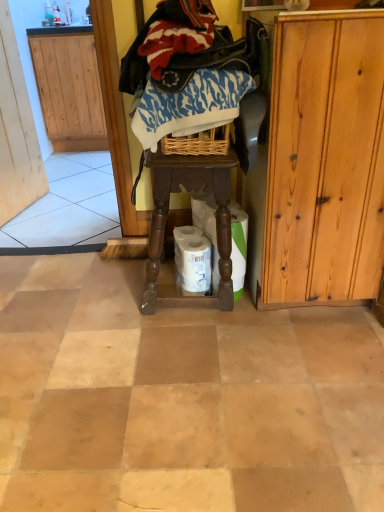
Looking at this image, measure the distance between point (350, 153) and camera.

Point (350, 153) is 3.73 feet from camera.

The width and height of the screenshot is (384, 512). I want to click on white matte toilet paper at center, which is the second toilet paper from left to right, so click(207, 228).

The width and height of the screenshot is (384, 512). Describe the element at coordinates (207, 228) in the screenshot. I see `white matte toilet paper at center, which is the second toilet paper from left to right` at that location.

Image resolution: width=384 pixels, height=512 pixels. What are the coordinates of `brown wooden stool at center` in the screenshot? It's located at (167, 218).

In order to face blue printed fabric at center, the first clothing when ordered from bottom to top, should I rotate leftwards or rightwards?

Turn right by 0.180 degrees to look at blue printed fabric at center, the first clothing when ordered from bottom to top.

What do you see at coordinates (192, 260) in the screenshot?
I see `white matte toilet paper at center, which is counted as the 1th toilet paper, starting from the left` at bounding box center [192, 260].

Identify the location of light brown wood cabinet at right. Image resolution: width=384 pixels, height=512 pixels. tap(325, 159).

What's the angular difference between knitted wool sweater at upper center, acting as the 2th clothing starting from the bottom, and blue printed fabric at center, the first clothing when ordered from bottom to top,'s facing directions?

The angle between the facing direction of knitted wool sweater at upper center, acting as the 2th clothing starting from the bottom, and the facing direction of blue printed fabric at center, the first clothing when ordered from bottom to top, is 0.00235 degrees.

Is knitted wool sweater at upper center, acting as the 2th clothing starting from the bottom, at the right side of blue printed fabric at center, which is the 2th clothing in top-to-bottom order?

No, knitted wool sweater at upper center, acting as the 2th clothing starting from the bottom, is not to the right of blue printed fabric at center, which is the 2th clothing in top-to-bottom order.

Consider the image. Can you confirm if knitted wool sweater at upper center, acting as the 2th clothing starting from the bottom, is thinner than blue printed fabric at center, which is the 2th clothing in top-to-bottom order?

Incorrect, the width of knitted wool sweater at upper center, acting as the 2th clothing starting from the bottom, is not less than that of blue printed fabric at center, which is the 2th clothing in top-to-bottom order.

Does knitted wool sweater at upper center, acting as the 2th clothing starting from the bottom, touch blue printed fabric at center, the first clothing when ordered from bottom to top?

Yes.

Between brown wooden stool at center and light brown wood cabinet at right, which one has more height?

With more height is light brown wood cabinet at right.

Which is more to the right, brown wooden stool at center or light brown wood cabinet at right?

Positioned to the right is light brown wood cabinet at right.

Is point (224, 207) farther from viewer compared to point (280, 219)?

Yes, it is.

Visually, is knitted wool sweater at upper center, acting as the 2th clothing starting from the bottom, positioned to the left or to the right of white matte toilet paper at center, which ranks as the second toilet paper in right-to-left order?

From the image, it's evident that knitted wool sweater at upper center, acting as the 2th clothing starting from the bottom, is to the left of white matte toilet paper at center, which ranks as the second toilet paper in right-to-left order.

Consider the image. From the image's perspective, relative to white matte toilet paper at center, which is counted as the 1th toilet paper, starting from the left, is knitted wool sweater at upper center, placed as the first clothing when sorted from top to bottom, above or below?

Based on their image positions, knitted wool sweater at upper center, placed as the first clothing when sorted from top to bottom, is located above white matte toilet paper at center, which is counted as the 1th toilet paper, starting from the left.

Considering the sizes of objects knitted wool sweater at upper center, acting as the 2th clothing starting from the bottom, and white matte toilet paper at center, which ranks as the second toilet paper in right-to-left order, in the image provided, who is taller, knitted wool sweater at upper center, acting as the 2th clothing starting from the bottom, or white matte toilet paper at center, which ranks as the second toilet paper in right-to-left order,?

knitted wool sweater at upper center, acting as the 2th clothing starting from the bottom.

From a real-world perspective, who is located higher, knitted wool sweater at upper center, placed as the first clothing when sorted from top to bottom, or white matte toilet paper at center, which ranks as the second toilet paper in right-to-left order?

knitted wool sweater at upper center, placed as the first clothing when sorted from top to bottom, from a real-world perspective.

From the image's perspective, relative to blue printed fabric at center, which is the 2th clothing in top-to-bottom order, is white matte toilet paper at center, which ranks as the second toilet paper in right-to-left order, above or below?

Based on their image positions, white matte toilet paper at center, which ranks as the second toilet paper in right-to-left order, is located beneath blue printed fabric at center, which is the 2th clothing in top-to-bottom order.

Is white matte toilet paper at center, which is counted as the 1th toilet paper, starting from the left, directly adjacent to blue printed fabric at center, the first clothing when ordered from bottom to top?

They are not placed beside each other.

Considering the relative positions of white matte toilet paper at center, which ranks as the second toilet paper in right-to-left order, and blue printed fabric at center, the first clothing when ordered from bottom to top, in the image provided, is white matte toilet paper at center, which ranks as the second toilet paper in right-to-left order, in front of blue printed fabric at center, the first clothing when ordered from bottom to top,?

No, white matte toilet paper at center, which ranks as the second toilet paper in right-to-left order, is behind blue printed fabric at center, the first clothing when ordered from bottom to top.

Is white matte toilet paper at center, which is counted as the 1th toilet paper, starting from the left, turned away from blue printed fabric at center, which is the 2th clothing in top-to-bottom order?

No, blue printed fabric at center, which is the 2th clothing in top-to-bottom order, is not at the back of white matte toilet paper at center, which is counted as the 1th toilet paper, starting from the left.

Is wooden screen door at left aimed at white matte toilet paper at center, which is counted as the 1th toilet paper, starting from the left?

No.

From the image's perspective, would you say wooden screen door at left is shown under white matte toilet paper at center, which ranks as the second toilet paper in right-to-left order?

Actually, wooden screen door at left appears above white matte toilet paper at center, which ranks as the second toilet paper in right-to-left order, in the image.

Which is farther from the camera, (x=186, y=250) or (x=318, y=182)?

The point (x=186, y=250) is more distant.

From the image's perspective, between white matte toilet paper at center, which ranks as the second toilet paper in right-to-left order, and light brown wood cabinet at right, which one is located above?

light brown wood cabinet at right is shown above in the image.

How different are the orientations of white matte toilet paper at center, which is counted as the 1th toilet paper, starting from the left, and light brown wood cabinet at right in degrees?

They differ by 67.1 degrees in their facing directions.

From a real-world perspective, between white matte toilet paper at center, which ranks as the second toilet paper in right-to-left order, and light brown wood cabinet at right, who is vertically higher?

light brown wood cabinet at right.

Locate an element on the screen. This screenshot has width=384, height=512. cabinetry behind the knitted wool sweater at upper center, acting as the 2th clothing starting from the bottom is located at coordinates (325, 159).

Which of these two, knitted wool sweater at upper center, acting as the 2th clothing starting from the bottom, or light brown wood cabinet at right, stands taller?

With more height is light brown wood cabinet at right.

From the image's perspective, between knitted wool sweater at upper center, placed as the first clothing when sorted from top to bottom, and light brown wood cabinet at right, who is located below?

light brown wood cabinet at right appears lower in the image.

From a real-world perspective, between knitted wool sweater at upper center, acting as the 2th clothing starting from the bottom, and light brown wood cabinet at right, who is vertically lower?

From a 3D spatial view, light brown wood cabinet at right is below.

Where is `clothing on the right of knitted wool sweater at upper center, acting as the 2th clothing starting from the bottom`? This screenshot has width=384, height=512. clothing on the right of knitted wool sweater at upper center, acting as the 2th clothing starting from the bottom is located at coordinates (189, 106).

Image resolution: width=384 pixels, height=512 pixels. I want to click on furniture that is on the left side of light brown wood cabinet at right, so pyautogui.click(x=167, y=218).

Which object lies further to the anchor point blue printed fabric at center, which is the 2th clothing in top-to-bottom order, wooden screen door at left or white matte toilet paper at center, which ranks as the second toilet paper in right-to-left order?

wooden screen door at left is positioned further to the anchor blue printed fabric at center, which is the 2th clothing in top-to-bottom order.

Consider the image. Considering their positions, is white matte toilet paper at center, which is the second toilet paper from left to right, positioned closer to white matte toilet paper at center, which ranks as the second toilet paper in right-to-left order, than knitted wool sweater at upper center, acting as the 2th clothing starting from the bottom?

Based on the image, white matte toilet paper at center, which is the second toilet paper from left to right, appears to be nearer to white matte toilet paper at center, which ranks as the second toilet paper in right-to-left order.

Looking at the image, which one is located closer to white matte toilet paper at center, acting as the 1th toilet paper starting from the right, white matte toilet paper at center, which is counted as the 1th toilet paper, starting from the left, or brown wooden stool at center?

white matte toilet paper at center, which is counted as the 1th toilet paper, starting from the left, is positioned closer to the anchor white matte toilet paper at center, acting as the 1th toilet paper starting from the right.

Considering their positions, is blue printed fabric at center, the first clothing when ordered from bottom to top, positioned closer to knitted wool sweater at upper center, acting as the 2th clothing starting from the bottom, than light brown wood cabinet at right?

blue printed fabric at center, the first clothing when ordered from bottom to top, lies closer to knitted wool sweater at upper center, acting as the 2th clothing starting from the bottom, than the other object.

Based on their spatial positions, is blue printed fabric at center, which is the 2th clothing in top-to-bottom order, or white matte toilet paper at center, acting as the 1th toilet paper starting from the right, closer to knitted wool sweater at upper center, acting as the 2th clothing starting from the bottom?

blue printed fabric at center, which is the 2th clothing in top-to-bottom order, is positioned closer to the anchor knitted wool sweater at upper center, acting as the 2th clothing starting from the bottom.

Looking at the image, which one is located closer to blue printed fabric at center, which is the 2th clothing in top-to-bottom order, white matte toilet paper at center, which is counted as the 1th toilet paper, starting from the left, or light brown wood cabinet at right?

light brown wood cabinet at right is positioned closer to the anchor blue printed fabric at center, which is the 2th clothing in top-to-bottom order.

Considering their positions, is knitted wool sweater at upper center, placed as the first clothing when sorted from top to bottom, positioned further to white matte toilet paper at center, which is the second toilet paper from left to right, than light brown wood cabinet at right?

knitted wool sweater at upper center, placed as the first clothing when sorted from top to bottom.

From the image, which object appears to be farther from white matte toilet paper at center, which ranks as the second toilet paper in right-to-left order, knitted wool sweater at upper center, placed as the first clothing when sorted from top to bottom, or brown wooden stool at center?

knitted wool sweater at upper center, placed as the first clothing when sorted from top to bottom.

Locate an element on the screen. toilet paper between blue printed fabric at center, which is the 2th clothing in top-to-bottom order, and white matte toilet paper at center, which is counted as the 1th toilet paper, starting from the left, from top to bottom is located at coordinates (207, 228).

You are a GUI agent. You are given a task and a screenshot of the screen. Output one action in this format:
    pyautogui.click(x=<x>, y=<y>)
    Task: Click on the toilet paper between wooden screen door at left and blue printed fabric at center, which is the 2th clothing in top-to-bottom order, in the horizontal direction
    The height and width of the screenshot is (512, 384).
    Given the screenshot: What is the action you would take?
    pyautogui.click(x=192, y=260)

Locate an element on the screen. clothing situated between wooden screen door at left and blue printed fabric at center, the first clothing when ordered from bottom to top, from left to right is located at coordinates (187, 82).

This screenshot has width=384, height=512. I want to click on cabinetry between blue printed fabric at center, which is the 2th clothing in top-to-bottom order, and white matte toilet paper at center, which ranks as the second toilet paper in right-to-left order, in the vertical direction, so click(325, 159).